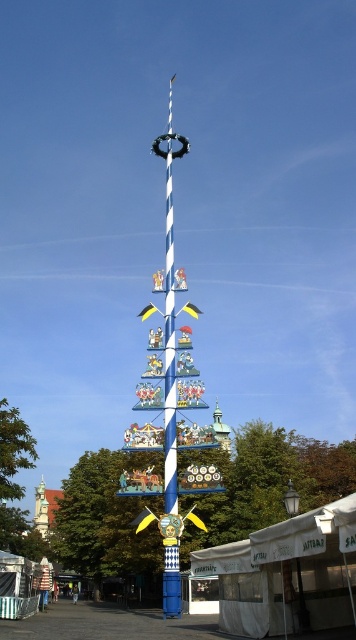
You are standing at the center of the image looking towards the Maypole. Which object is positioned higher relative to the other between the white canvas tent at lower right and the smooth stone tower at lower left?

The white canvas tent at lower right is positioned higher than the smooth stone tower at lower left according to the spatial arrangement.

You are standing in front of the Maypole and want to find a place to rest. Which object, the white canvas tent at lower right or the smooth stone tower at lower left, is located to your right side?

The white canvas tent at lower right is located to your right side since it is positioned to the right of the smooth stone tower at lower left.

You are planning to set up a picnic area near the Maypole. You have a picnic blanket that can comfortably fit 6 people. The white canvas tent at lower right and the smooth stone tower at lower left are both potential locations. Which location offers more horizontal space for your picnic?

The white canvas tent at lower right might be wider than smooth stone tower at lower left, so it could provide more horizontal space for your picnic.